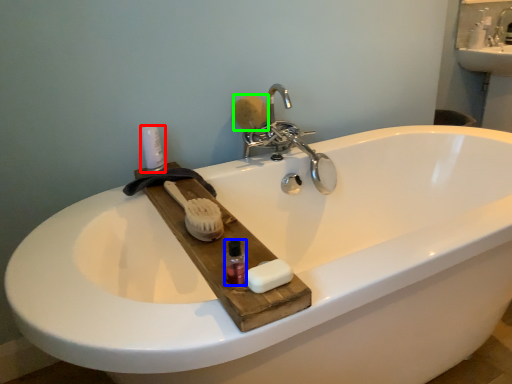
Question: Which is farther away from toiletry (highlighted by a red box)? mouthwash (highlighted by a blue box) or soap (highlighted by a green box)?

Choices:
 (A) mouthwash
 (B) soap

Answer: (A)